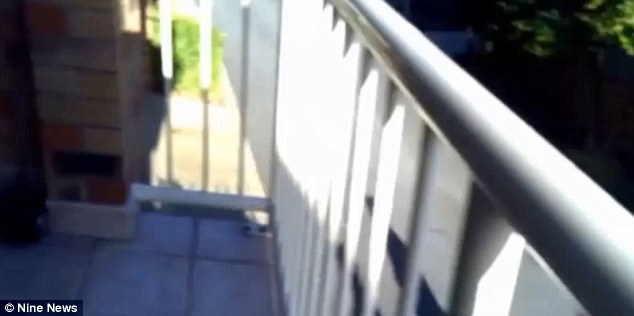
Locate an element on the screen. This screenshot has width=634, height=316. floor tile touch brick pillar is located at coordinates (184, 227), (70, 238).